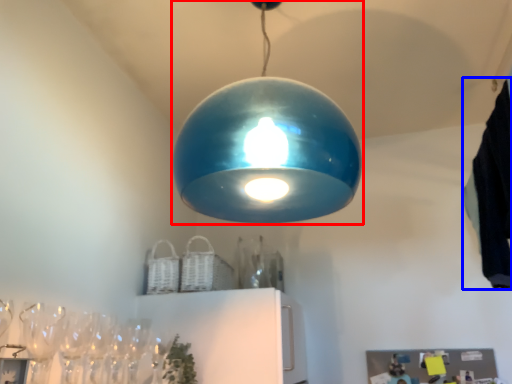
Question: Among these objects, which one is farthest to the camera, lamp (highlighted by a red box) or laundry (highlighted by a blue box)?

Choices:
 (A) lamp
 (B) laundry

Answer: (B)